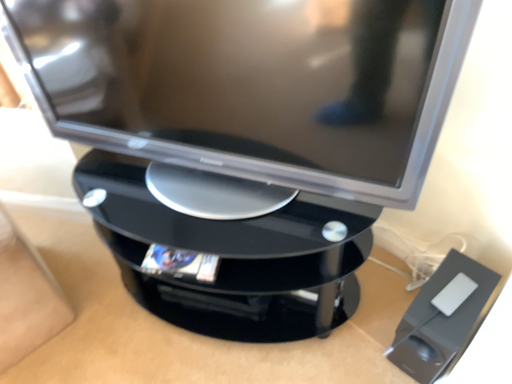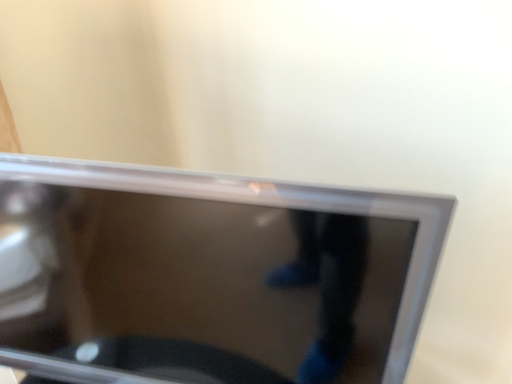
Question: Which way did the camera rotate in the video?

Choices:
 (A) rotated right
 (B) rotated left

Answer: (A)